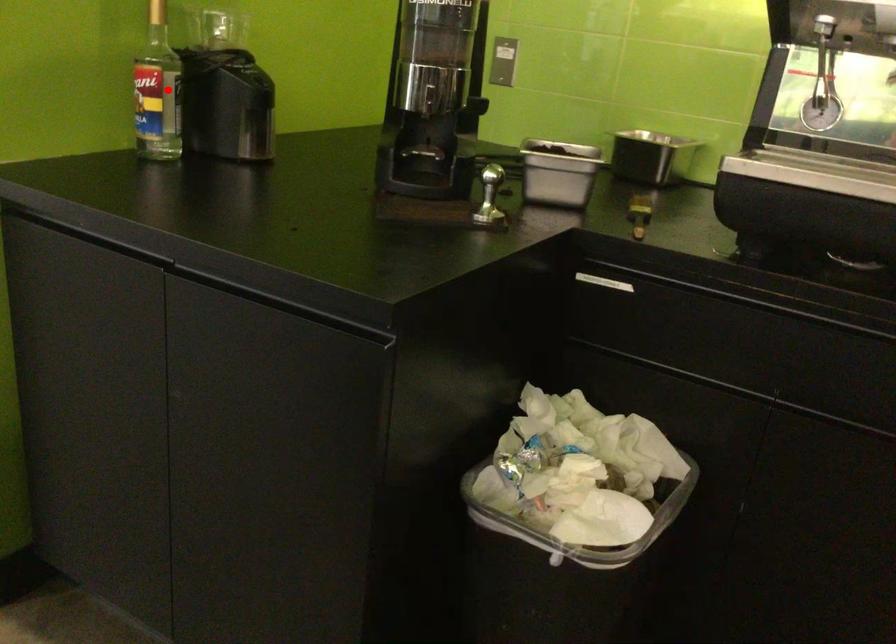
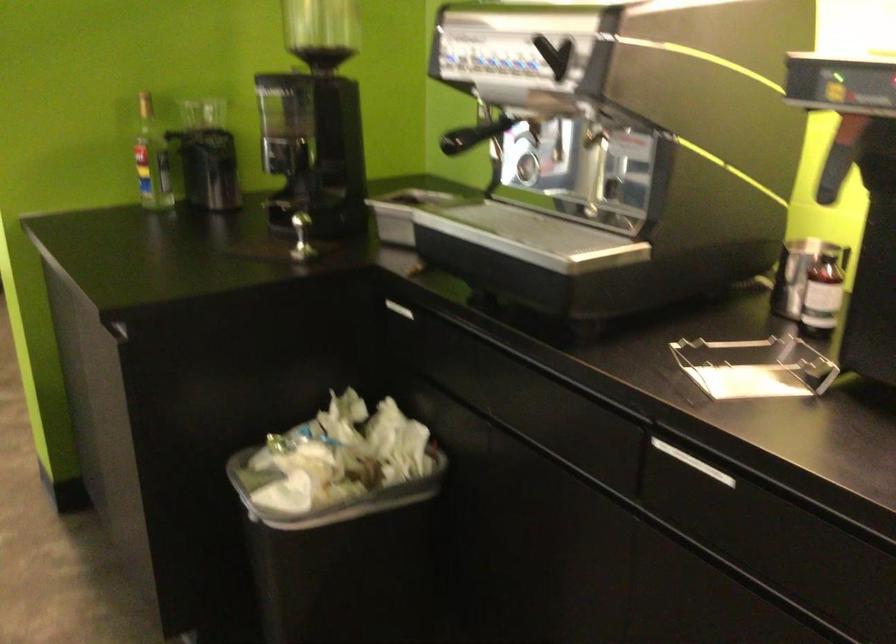
Question: I am providing you with two images of the same scene from different viewpoints. Given a red point in image1, look at the same physical point in image2. Is it:

Choices:
 (A) Closer to the viewpoint
 (B) Farther from the viewpoint

Answer: (B)